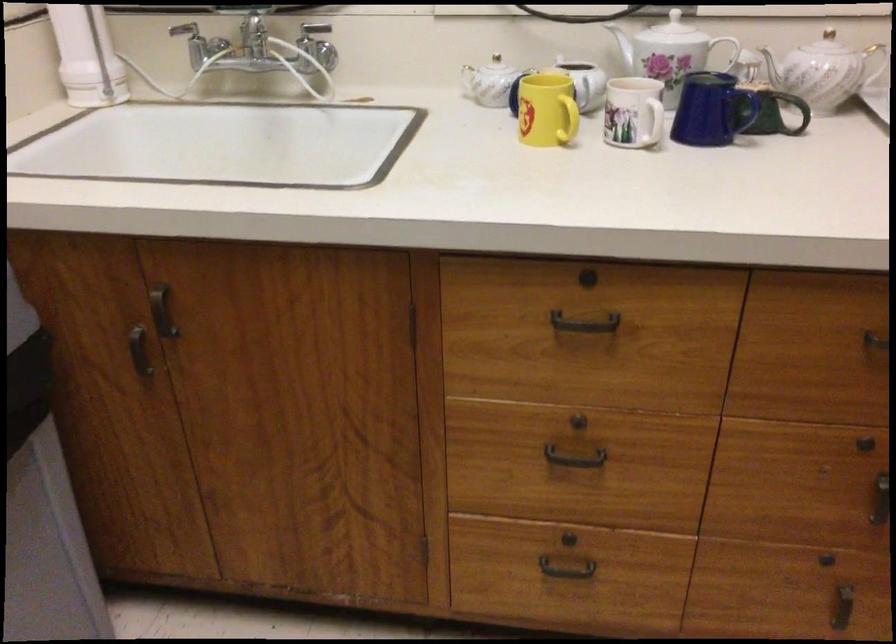
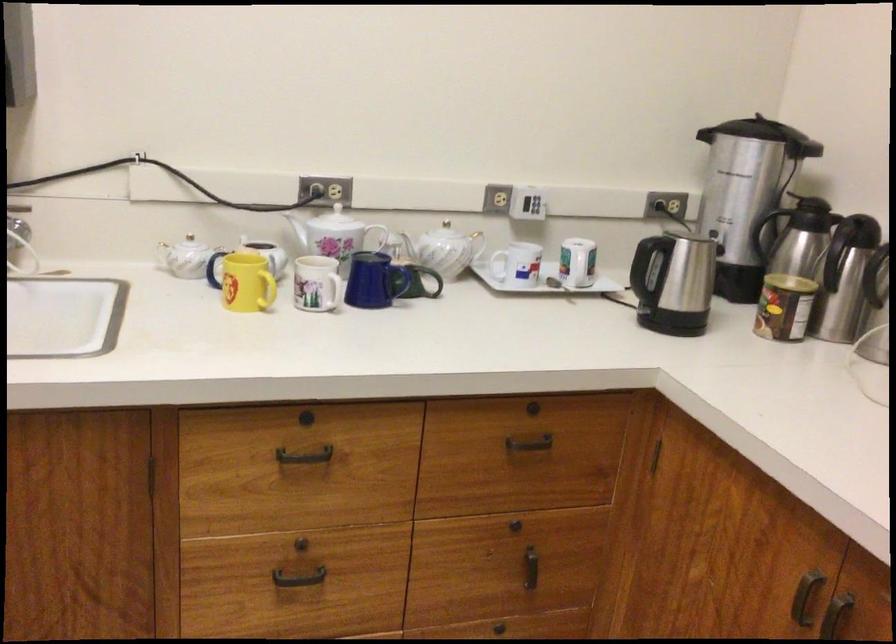
The point at [705,106] is marked in the first image. Where is the corresponding point in the second image?

(375, 281)